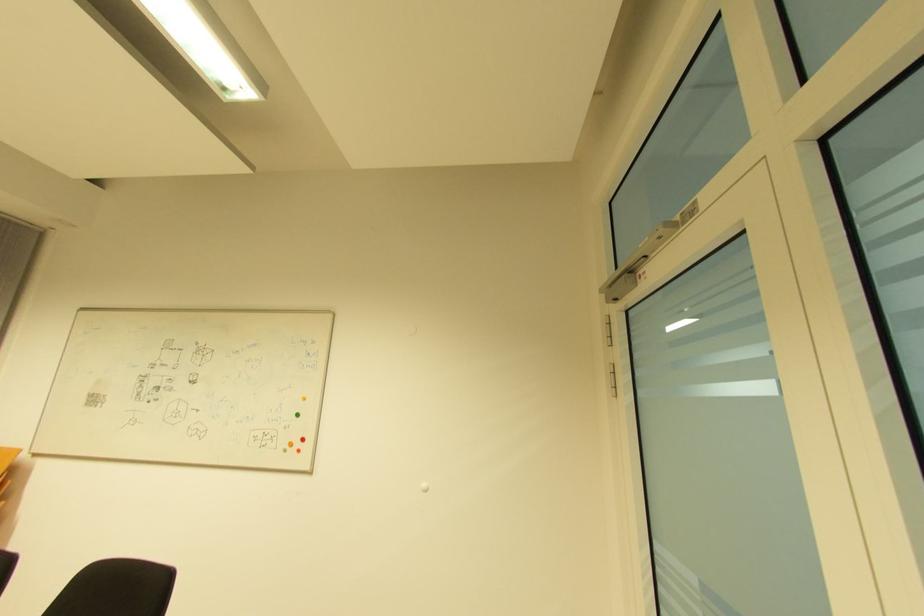
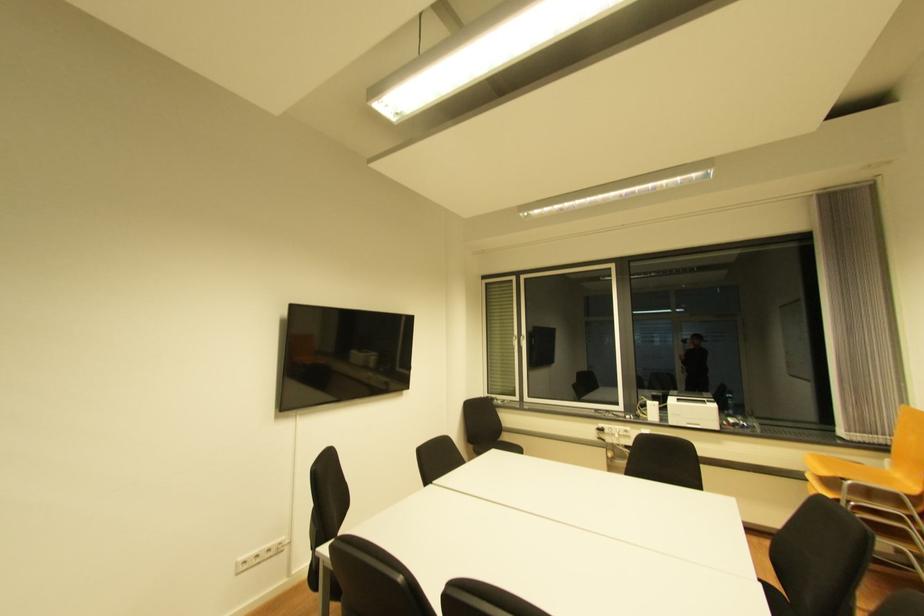
Question: The camera is either moving clockwise (left) or counter-clockwise (right) around the object. The first image is from the beginning of the video and the second image is from the end. Is the camera moving left or right when shooting the video?

Choices:
 (A) Left
 (B) Right

Answer: (B)